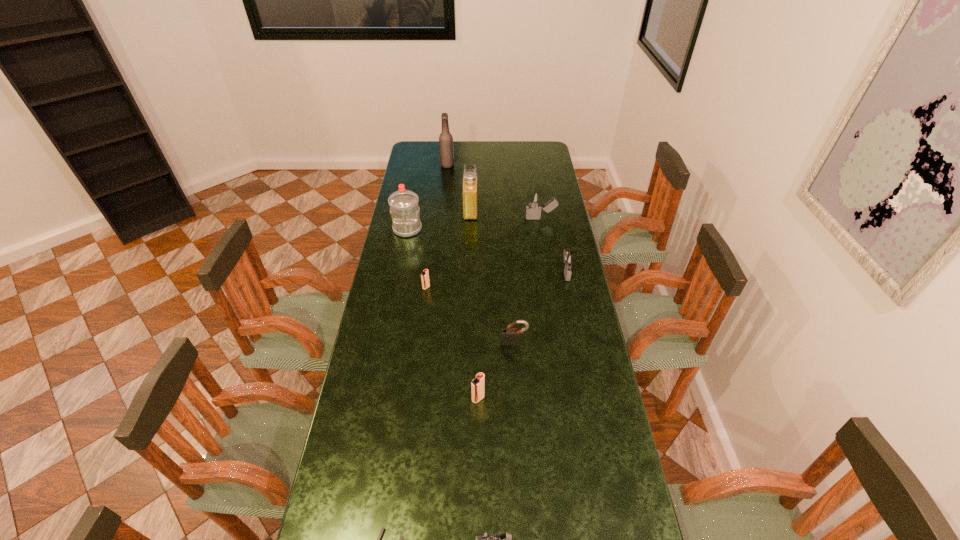
Locate an element on the screen. This screenshot has width=960, height=540. vacant space that satisfies the following two spatial constraints: 1. on the front-facing side of the perfume; 2. on the front side of the left red igniter is located at coordinates (468, 287).